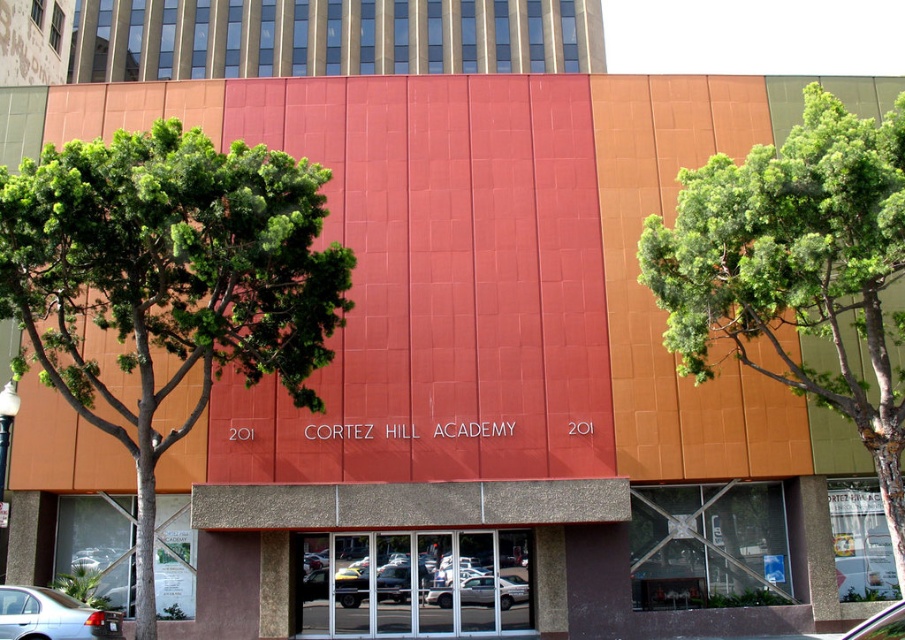
Does green leafy tree at upper right appear under silver metallic sedan at center?

Actually, green leafy tree at upper right is above silver metallic sedan at center.

Between point (821, 109) and point (518, 579), which one is positioned in front?

Positioned in front is point (821, 109).

Who is more distant from viewer, (884, 221) or (510, 577)?

Point (510, 577)

This screenshot has height=640, width=905. Find the location of `green leafy tree at upper right`. green leafy tree at upper right is located at coordinates tap(797, 269).

Find the location of `green leafy tree at upper right`. green leafy tree at upper right is located at coordinates (797, 269).

Locate an element on the screen. green leafy tree at upper right is located at coordinates (797, 269).

Where is `green leafy tree at upper right`? This screenshot has height=640, width=905. green leafy tree at upper right is located at coordinates (797, 269).

Does silver metallic sedan at lower left appear on the right side of metallic silver car at center?

In fact, silver metallic sedan at lower left is to the left of metallic silver car at center.

Is point (90, 611) positioned before point (888, 620)?

No, it is not.

The height and width of the screenshot is (640, 905). Find the location of `silver metallic sedan at lower left`. silver metallic sedan at lower left is located at coordinates (52, 616).